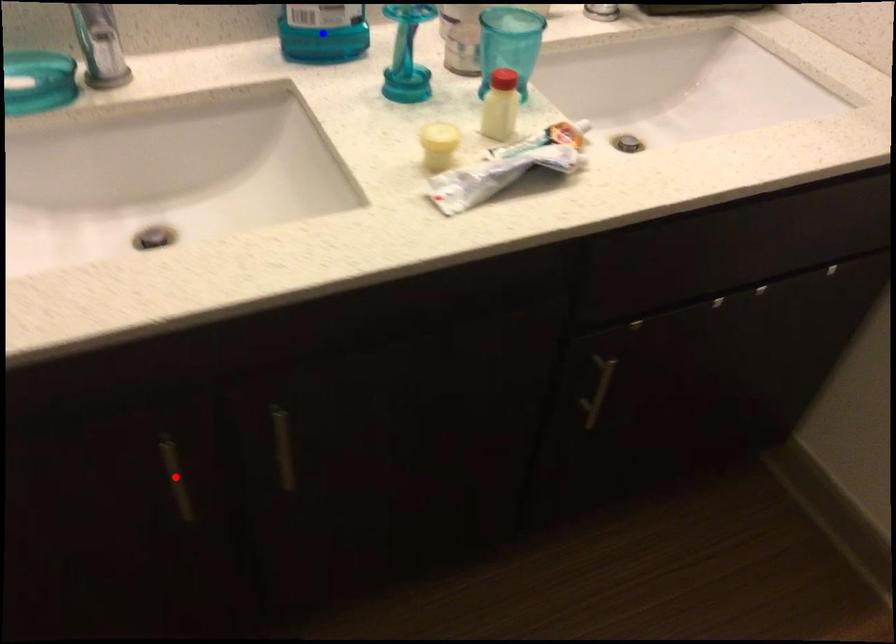
Question: In the image, two points are highlighted. Which point is nearer to the camera? Reply with the corresponding letter.

Choices:
 (A) blue point
 (B) red point

Answer: (B)